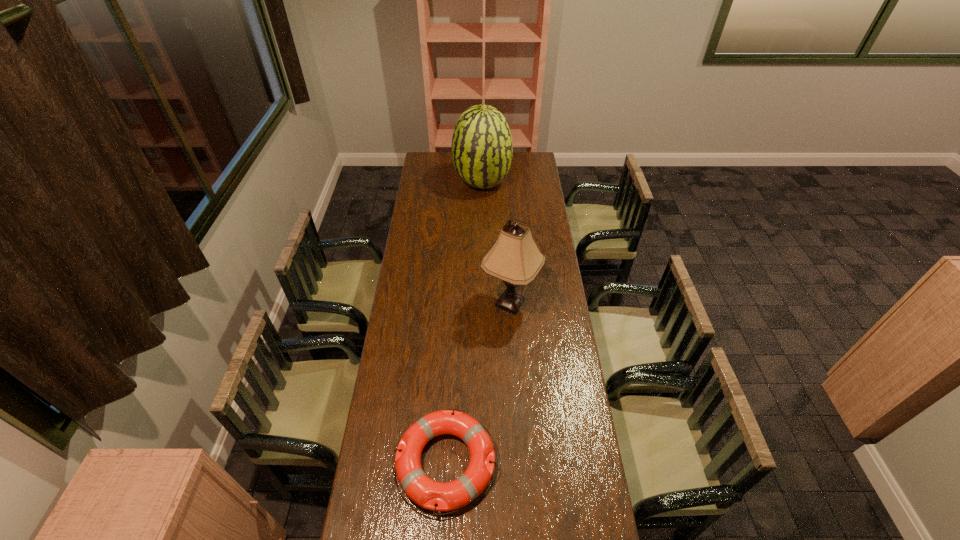
In the image, there is a desktop. Where is `vacant region at the far edge`? The image size is (960, 540). vacant region at the far edge is located at coordinates (510, 172).

Locate an element on the screen. vacant space at the left edge of the desktop is located at coordinates (424, 192).

Image resolution: width=960 pixels, height=540 pixels. In order to click on vacant space at the right edge of the desktop in this screenshot , I will do [575, 529].

In order to click on free space at the far right corner of the desktop in this screenshot , I will do `click(533, 162)`.

Identify the location of vacant region between the lamp and the nearest object. (478, 383).

This screenshot has height=540, width=960. Find the location of `unoccupied position between the watermelon and the shortest object`. unoccupied position between the watermelon and the shortest object is located at coordinates (464, 323).

I want to click on blank region between the lamp and the shortest object, so click(x=478, y=383).

At what (x,y) coordinates should I click in order to perform the action: click on empty location between the life buoy and the lamp. Please return your answer as a coordinate pair (x, y). The width and height of the screenshot is (960, 540). Looking at the image, I should click on (478, 383).

Find the location of a particular element. object identified as the closest to the watermelon is located at coordinates (515, 259).

Where is `object that stands as the second closest to the life buoy`? The height and width of the screenshot is (540, 960). object that stands as the second closest to the life buoy is located at coordinates (482, 149).